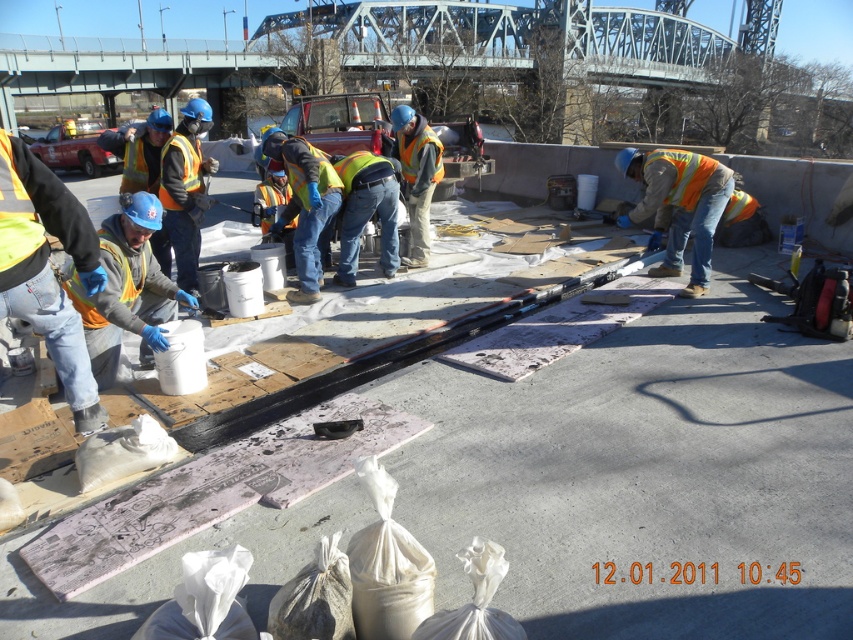
Is matte gray bucket at lower left positioned before orange reflective vest at right?

Yes, matte gray bucket at lower left is closer to the viewer.

Locate an element on the screen. matte gray bucket at lower left is located at coordinates (126, 289).

Is matte gray bucket at lower left bigger than orange reflective vest at center?

Indeed, matte gray bucket at lower left has a larger size compared to orange reflective vest at center.

Is matte gray bucket at lower left closer to camera compared to orange reflective vest at center?

Yes.

Which is in front, point (148, 307) or point (438, 179)?

Point (148, 307) is in front.

Find the location of a particular element. This screenshot has height=640, width=853. matte gray bucket at lower left is located at coordinates (126, 289).

Is orange reflective vest at right in front of orange reflective vest at center?

Yes, it is.

Is point (666, 216) closer to camera compared to point (416, 176)?

Yes.

Locate an element on the screen. The height and width of the screenshot is (640, 853). orange reflective vest at right is located at coordinates (677, 205).